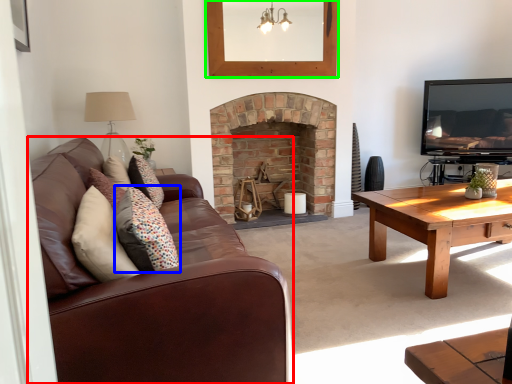
Question: Based on their relative distances, which object is farther from studio couch (highlighted by a red box)? Choose from pillow (highlighted by a blue box) and picture frame (highlighted by a green box).

Choices:
 (A) pillow
 (B) picture frame

Answer: (B)